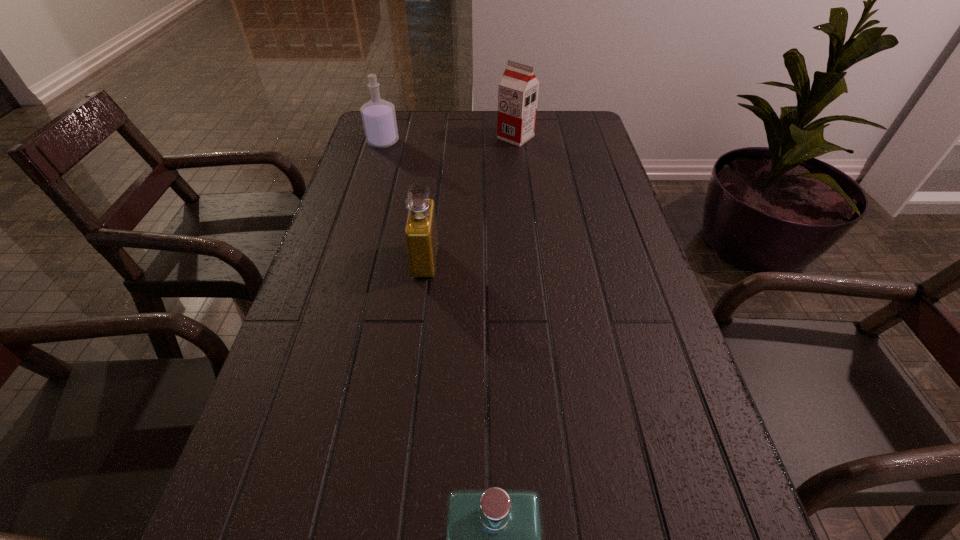
The height and width of the screenshot is (540, 960). I want to click on soya milk, so click(518, 89).

Identify the location of the leftmost object. (379, 119).

Find the location of a particular element. The width and height of the screenshot is (960, 540). the leftmost perfume is located at coordinates (379, 119).

This screenshot has width=960, height=540. Find the location of `the second object from left to right`. the second object from left to right is located at coordinates (421, 237).

The width and height of the screenshot is (960, 540). In order to click on the second perfume from left to right in this screenshot , I will do (421, 237).

The height and width of the screenshot is (540, 960). In order to click on free space located on the right of the soya milk in this screenshot , I will do `click(561, 137)`.

Find the location of `vacant position located on the right of the leftmost object`. vacant position located on the right of the leftmost object is located at coordinates (475, 141).

Find the location of a particular element. This screenshot has height=540, width=960. free space located 0.090m on the front-facing side of the third farthest object is located at coordinates (477, 260).

Where is `soya milk that is at the far edge`? Image resolution: width=960 pixels, height=540 pixels. soya milk that is at the far edge is located at coordinates (518, 89).

Find the location of `perfume located in the far edge section of the desktop`. perfume located in the far edge section of the desktop is located at coordinates (379, 119).